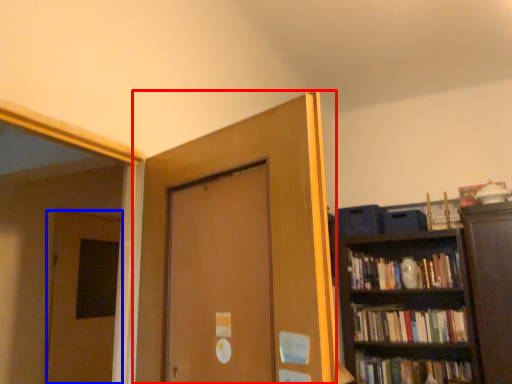
Question: Which of the following is the closest to the observer, door (highlighted by a red box) or door (highlighted by a blue box)?

Choices:
 (A) door
 (B) door

Answer: (A)